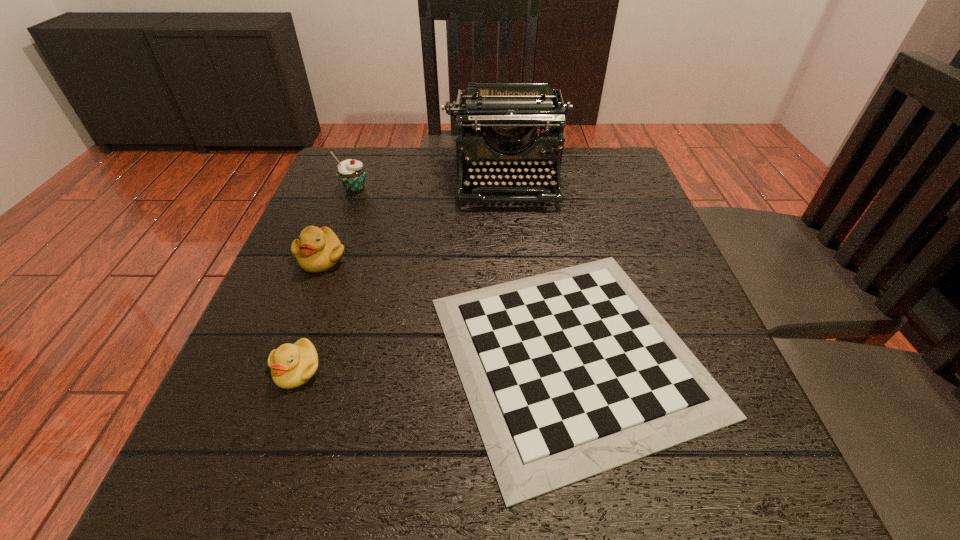
The image size is (960, 540). I want to click on vacant region at the near edge of the desktop, so click(x=479, y=462).

This screenshot has height=540, width=960. In the image, there is a desktop. In order to click on blank space at the left edge in this screenshot , I will do `click(312, 288)`.

At what (x,y) coordinates should I click in order to perform the action: click on vacant space at the right edge of the desktop. Please return your answer as a coordinate pair (x, y). Looking at the image, I should click on (613, 202).

What are the coordinates of `blank space at the far left corner` in the screenshot? It's located at (339, 154).

I want to click on free space between the chessboard and the second tallest object, so click(x=463, y=271).

At what (x,y) coordinates should I click in order to perform the action: click on free space between the fourth tallest object and the third tallest object. Please return your answer as a coordinate pair (x, y). Looking at the image, I should click on (309, 313).

This screenshot has width=960, height=540. In order to click on vacant space that's between the chessboard and the fourth shortest object in this screenshot , I will do `click(463, 271)`.

Where is `vacant space that is in between the shorter duckling and the farther duckling`? vacant space that is in between the shorter duckling and the farther duckling is located at coordinates 309,313.

Image resolution: width=960 pixels, height=540 pixels. What are the coordinates of `vacant space that is in between the cupcake and the chessboard` in the screenshot? It's located at (463, 271).

Locate an element on the screen. free space between the fourth shortest object and the shorter duckling is located at coordinates (326, 279).